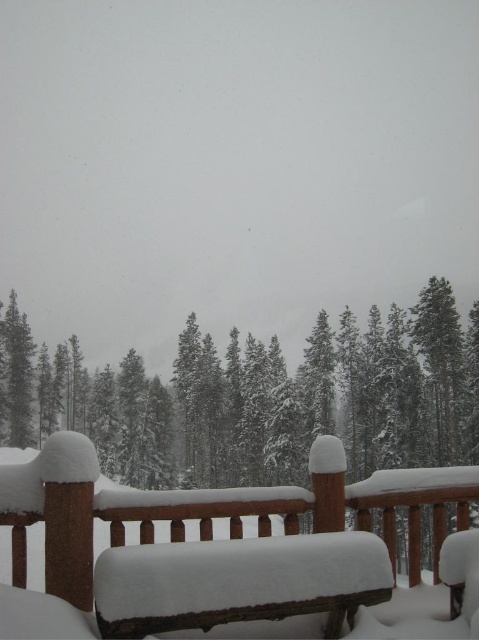
Between snow-covered wood bench at center and snow-covered pine at center, which one has more height?

snow-covered pine at center is taller.

Is point (173, 490) less distant than point (168, 477)?

That is True.

Find the location of a particular element. The width and height of the screenshot is (479, 640). snow-covered wood bench at center is located at coordinates (236, 554).